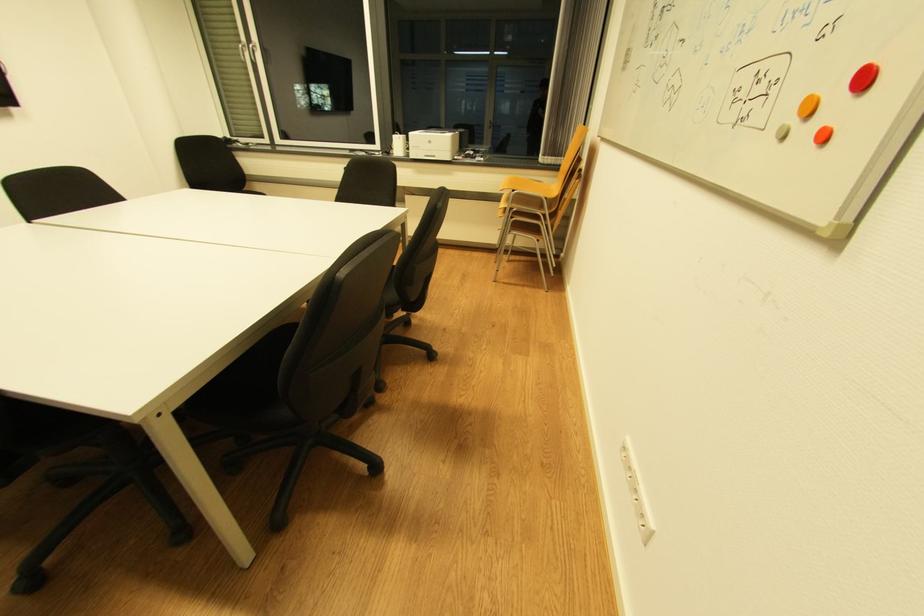
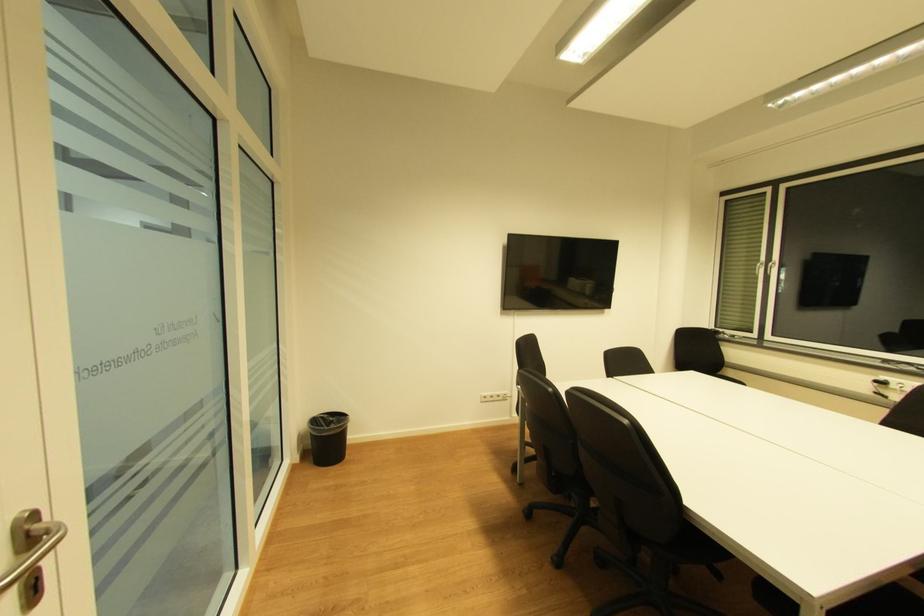
Question: The camera is either moving clockwise (left) or counter-clockwise (right) around the object. The first image is from the beginning of the video and the second image is from the end. Is the camera moving left or right when shooting the video?

Choices:
 (A) Left
 (B) Right

Answer: (B)